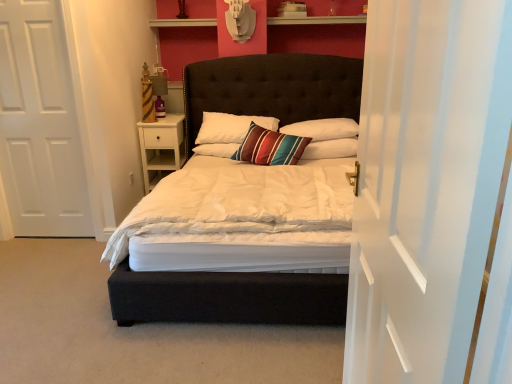
Question: In which direction should I rotate to look at white soft pillow at center, acting as the 1th pillow starting from the right?

Choices:
 (A) right
 (B) left

Answer: (A)

Question: Is white wood nightstand at left taller than velvet dark brown bed at center?

Choices:
 (A) no
 (B) yes

Answer: (A)

Question: Is white wood nightstand at left at the left side of velvet dark brown bed at center?

Choices:
 (A) yes
 (B) no

Answer: (A)

Question: Is white wood nightstand at left positioned far away from velvet dark brown bed at center?

Choices:
 (A) no
 (B) yes

Answer: (A)

Question: Considering the relative sizes of white wood nightstand at left and velvet dark brown bed at center in the image provided, is white wood nightstand at left shorter than velvet dark brown bed at center?

Choices:
 (A) no
 (B) yes

Answer: (B)

Question: Does white wood nightstand at left lie behind velvet dark brown bed at center?

Choices:
 (A) no
 (B) yes

Answer: (B)

Question: Is white wood nightstand at left turned away from velvet dark brown bed at center?

Choices:
 (A) yes
 (B) no

Answer: (B)

Question: Is white soft pillow at center, which is counted as the third pillow, starting from the left, bigger than white wood nightstand at left?

Choices:
 (A) no
 (B) yes

Answer: (A)

Question: Considering the relative sizes of white soft pillow at center, acting as the 1th pillow starting from the right, and white wood nightstand at left in the image provided, is white soft pillow at center, acting as the 1th pillow starting from the right, thinner than white wood nightstand at left?

Choices:
 (A) yes
 (B) no

Answer: (A)

Question: From a real-world perspective, is white soft pillow at center, which is counted as the third pillow, starting from the left, positioned over white wood nightstand at left based on gravity?

Choices:
 (A) no
 (B) yes

Answer: (B)

Question: Is white soft pillow at center, which is counted as the third pillow, starting from the left, wider than white wood nightstand at left?

Choices:
 (A) no
 (B) yes

Answer: (A)

Question: Is white soft pillow at center, acting as the 1th pillow starting from the right, at the right side of white wood nightstand at left?

Choices:
 (A) yes
 (B) no

Answer: (A)

Question: Is white soft pillow at center, acting as the 1th pillow starting from the right, far away from white wood nightstand at left?

Choices:
 (A) no
 (B) yes

Answer: (B)

Question: From a real-world perspective, does velvet dark brown bed at center sit lower than white sheer curtain at right?

Choices:
 (A) no
 (B) yes

Answer: (B)